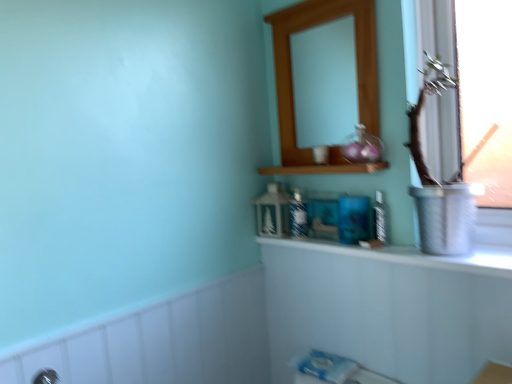
Question: From the image's perspective, relative to clear plastic bottle at center, the first toiletry from the front, is wooden medicine cabinet at upper center above or below?

Choices:
 (A) below
 (B) above

Answer: (B)

Question: Considering their positions, is wooden medicine cabinet at upper center located in front of or behind clear plastic bottle at center, the first toiletry from the front?

Choices:
 (A) front
 (B) behind

Answer: (A)

Question: Estimate the real-world distances between objects in this image. Which object is closer to the clear plastic bottle at center, which appears as the second toiletry when viewed from the back?

Choices:
 (A) white textured bath at lower left
 (B) wooden shelf at upper center
 (C) white glossy counter top at upper center
 (D) metallic silver vase at right
 (E) matte blue glass toiletry at center, which is the 1th toiletry in left-to-right order

Answer: (C)

Question: Which is farther from the wooden shelf at upper center?

Choices:
 (A) matte blue glass toiletry at center, which is counted as the first toiletry, starting from the back
 (B) metallic silver vase at right
 (C) clear plastic bottle at center, positioned as the 1th toiletry in right-to-left order
 (D) white glossy counter top at upper center
 (E) white textured bath at lower left

Answer: (E)